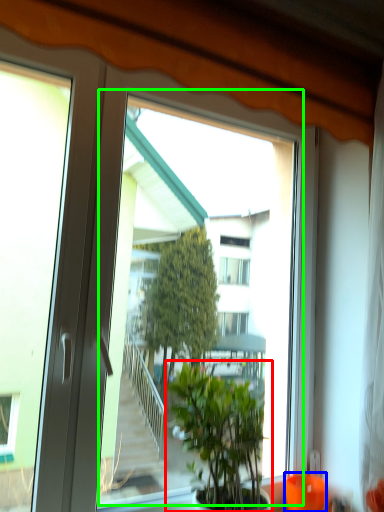
Question: Which is nearer to the houseplant (highlighted by a red box)? glass vase (highlighted by a blue box) or window screen (highlighted by a green box).

Choices:
 (A) glass vase
 (B) window screen

Answer: (B)